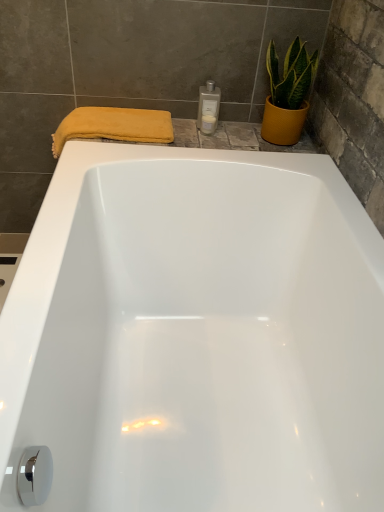
Find the location of `vacant area that lies in front of white glossy bottle at upper right, which appears as the second toiletry when ordered from the bottom`. vacant area that lies in front of white glossy bottle at upper right, which appears as the second toiletry when ordered from the bottom is located at coordinates (206, 140).